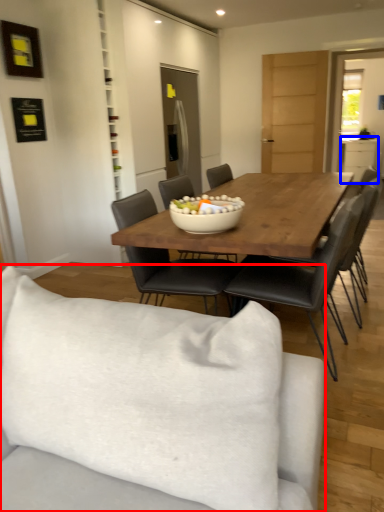
Question: Which object appears farthest to the camera in this image, studio couch (highlighted by a red box) or cabinetry (highlighted by a blue box)?

Choices:
 (A) studio couch
 (B) cabinetry

Answer: (B)